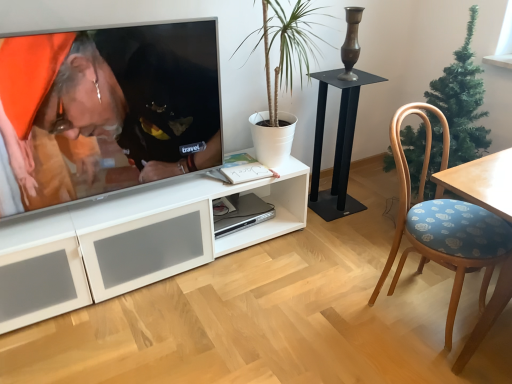
Image resolution: width=512 pixels, height=384 pixels. Find the location of `free spot to the left of green artificial christmas tree at right`. free spot to the left of green artificial christmas tree at right is located at coordinates (354, 235).